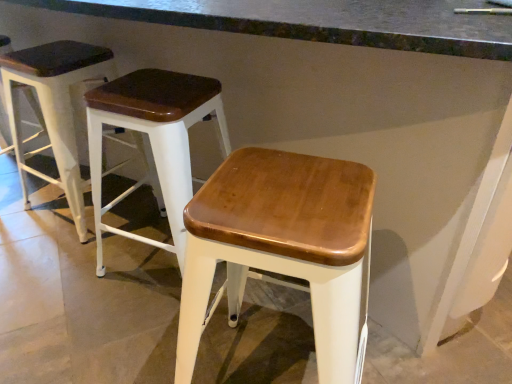
Question: Is wooden seat stool at left, which is the first stool in left-to-right order, oriented towards wooden seat at center, the third stool when ordered from left to right?

Choices:
 (A) yes
 (B) no

Answer: (B)

Question: Is the position of wooden seat stool at left, which is the first stool in left-to-right order, more distant than that of wooden seat at center, the third stool when ordered from left to right?

Choices:
 (A) yes
 (B) no

Answer: (A)

Question: Does wooden seat stool at left, which is the first stool in left-to-right order, have a greater height compared to wooden seat at center, the third stool when ordered from left to right?

Choices:
 (A) no
 (B) yes

Answer: (B)

Question: Can you confirm if wooden seat stool at left, which is the first stool in left-to-right order, is thinner than wooden seat at center, the 1th stool positioned from the right?

Choices:
 (A) no
 (B) yes

Answer: (A)

Question: Can you confirm if wooden seat stool at left, the third stool in the right-to-left sequence, is shorter than wooden seat at center, the 1th stool positioned from the right?

Choices:
 (A) yes
 (B) no

Answer: (B)

Question: From the image's perspective, is wooden seat stool at left, the third stool in the right-to-left sequence, above wooden seat at center, the third stool when ordered from left to right?

Choices:
 (A) no
 (B) yes

Answer: (B)

Question: Considering the relative sizes of smooth concrete at center and wooden seat at center, the third stool when ordered from left to right, in the image provided, is smooth concrete at center bigger than wooden seat at center, the third stool when ordered from left to right,?

Choices:
 (A) no
 (B) yes

Answer: (B)

Question: Is smooth concrete at center in contact with wooden seat at center, the third stool when ordered from left to right?

Choices:
 (A) no
 (B) yes

Answer: (A)

Question: Considering the relative sizes of smooth concrete at center and wooden seat at center, the third stool when ordered from left to right, in the image provided, is smooth concrete at center shorter than wooden seat at center, the third stool when ordered from left to right,?

Choices:
 (A) yes
 (B) no

Answer: (B)

Question: From the image's perspective, is smooth concrete at center on wooden seat at center, the 1th stool positioned from the right?

Choices:
 (A) no
 (B) yes

Answer: (B)

Question: From a real-world perspective, is smooth concrete at center on top of wooden seat at center, the 1th stool positioned from the right?

Choices:
 (A) yes
 (B) no

Answer: (A)

Question: Is smooth concrete at center at the left side of wooden seat at center, the third stool when ordered from left to right?

Choices:
 (A) no
 (B) yes

Answer: (B)

Question: Does wooden seat stool at left, the third stool in the right-to-left sequence, lie behind wooden seat at center, the 2th stool from the left?

Choices:
 (A) yes
 (B) no

Answer: (A)